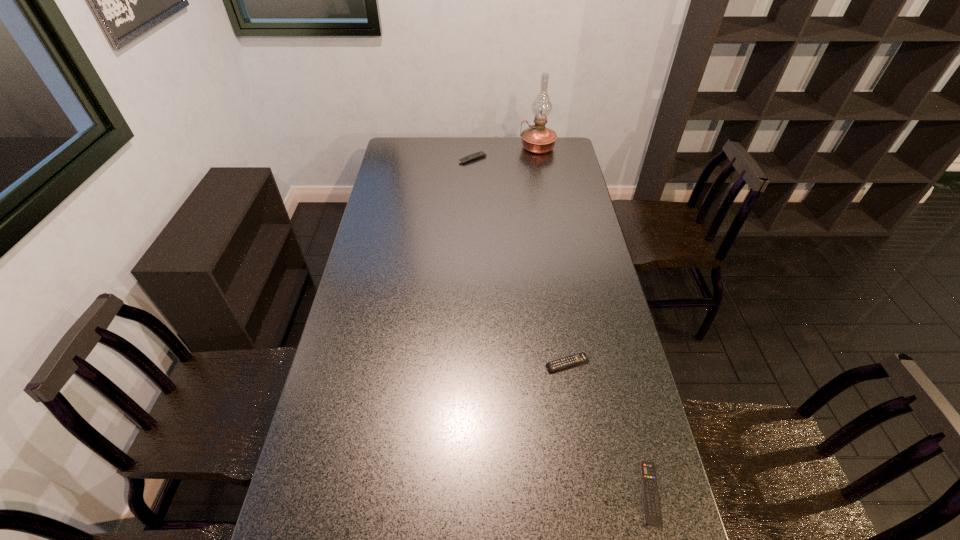
Locate an element on the screen. Image resolution: width=960 pixels, height=540 pixels. free spot between the shortest remote control and the farthest remote control is located at coordinates (562, 326).

Identify the location of empty space between the leftmost object and the shortest object. Image resolution: width=960 pixels, height=540 pixels. (562, 326).

Image resolution: width=960 pixels, height=540 pixels. What are the coordinates of `empty location between the second nearest object and the leftmost object` in the screenshot? It's located at (520, 261).

This screenshot has width=960, height=540. Find the location of `free space between the nearest object and the oil lamp`. free space between the nearest object and the oil lamp is located at coordinates tap(594, 321).

The width and height of the screenshot is (960, 540). What are the coordinates of `vacant region between the nearest object and the second shortest object` in the screenshot? It's located at 609,429.

Image resolution: width=960 pixels, height=540 pixels. I want to click on vacant area that lies between the second tallest remote control and the tallest object, so 552,255.

Where is `vacant space that's between the shortest object and the second nearest object`? The image size is (960, 540). vacant space that's between the shortest object and the second nearest object is located at coordinates (609, 429).

Where is `vacant space in between the nearest remote control and the second tallest object`? vacant space in between the nearest remote control and the second tallest object is located at coordinates (562, 326).

Where is `object identified as the third closest to the tallest remote control`? The height and width of the screenshot is (540, 960). object identified as the third closest to the tallest remote control is located at coordinates (653, 514).

Locate which object ranks in proximity to the rightmost object. Please provide its 2D coordinates. Your answer should be formatted as a tuple, i.e. [(x, y)], where the tuple contains the x and y coordinates of a point satisfying the conditions above.

[(581, 357)]